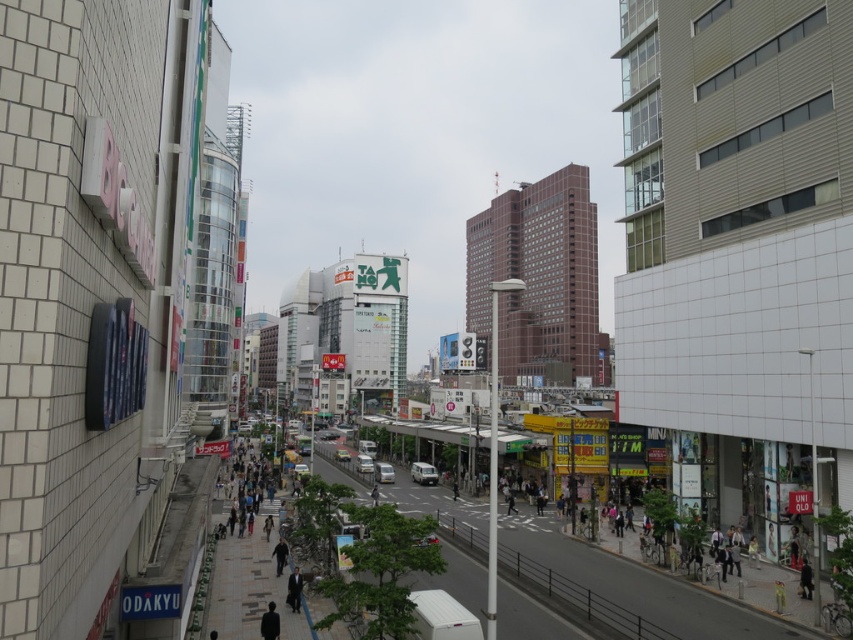
You are a delivery person standing on the pedestrian bridge overlooking the street. You need to deliver a package to the person wearing a dark gray suit at lower center. However, there is another person wearing a dark gray suit at center. How far apart are these two individuals?

The dark gray suit at lower center and dark gray suit at center are 16.20 feet apart from each other.